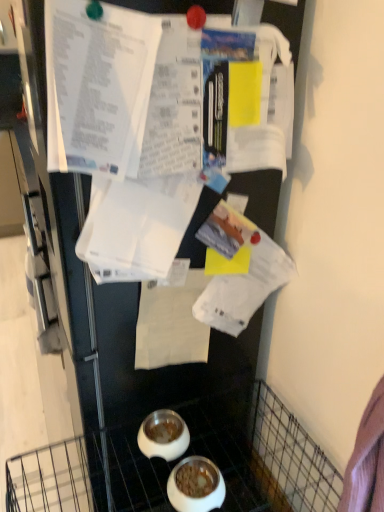
Question: Is white paper at center inside or outside of white glossy bowl at lower center, the 2th bowl from the front?

Choices:
 (A) inside
 (B) outside

Answer: (B)

Question: Is white paper at center taller or shorter than white glossy bowl at lower center, the 2th bowl from the front?

Choices:
 (A) tall
 (B) short

Answer: (A)

Question: Which of these objects is positioned farthest from the white paper at center?

Choices:
 (A) white glossy bowl at lower center, arranged as the 2th bowl when viewed from the back
 (B) white glossy bowl at lower center, the 2th bowl from the front

Answer: (A)

Question: Which of these objects is positioned farthest from the white glossy bowl at lower center, arranged as the 2th bowl when viewed from the back?

Choices:
 (A) white glossy bowl at lower center, the 1th bowl when ordered from back to front
 (B) white paper at center

Answer: (B)